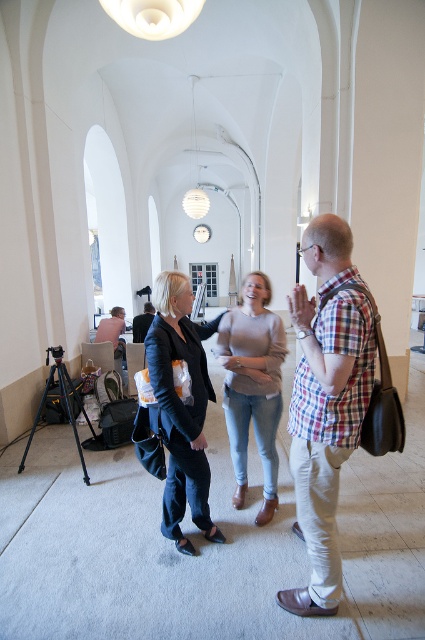
Question: Is dark blue fabric jacket at center in front of light gray sweater at center?

Choices:
 (A) no
 (B) yes

Answer: (B)

Question: Estimate the real-world distances between objects in this image. Which object is farther from the plaid cotton shirt at center?

Choices:
 (A) dark blue fabric jacket at center
 (B) matte black camera at center

Answer: (B)

Question: Does plaid cotton shirt at center have a larger size compared to dark blue fabric jacket at center?

Choices:
 (A) yes
 (B) no

Answer: (B)

Question: Estimate the real-world distances between objects in this image. Which object is closer to the plaid cotton shirt at center?

Choices:
 (A) matte black camera at center
 (B) light gray sweater at center

Answer: (B)

Question: Is plaid cotton shirt at center to the right of light gray sweater at center from the viewer's perspective?

Choices:
 (A) yes
 (B) no

Answer: (A)

Question: Which object is farther from the camera taking this photo?

Choices:
 (A) dark blue fabric jacket at center
 (B) matte black camera at center
 (C) light gray sweater at center

Answer: (B)